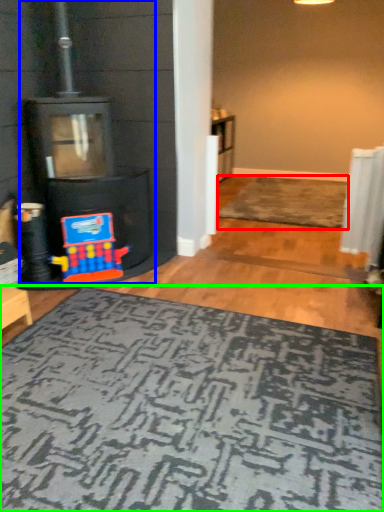
Question: Which is farther away from doormat (highlighted by a red box)? fireplace (highlighted by a blue box) or mat (highlighted by a green box)?

Choices:
 (A) fireplace
 (B) mat

Answer: (B)